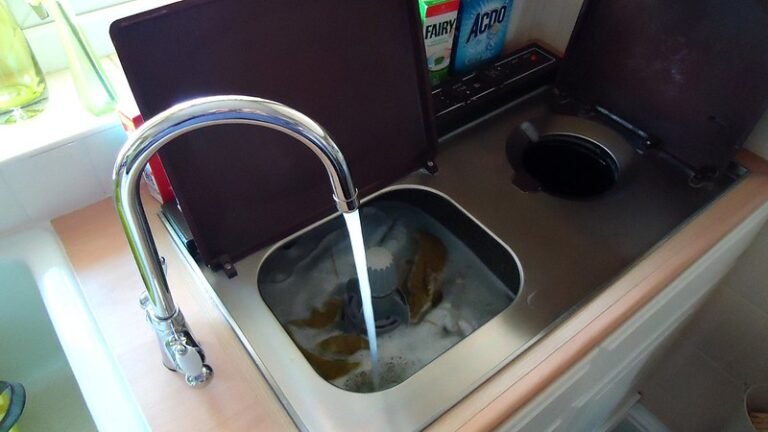
Where is `tile wall`? tile wall is located at coordinates (719, 333).